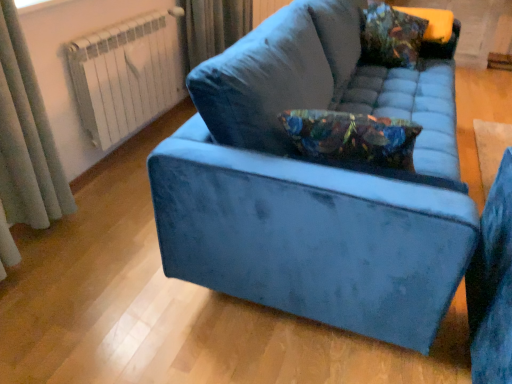
Identify the location of free space to the back side of gray fabric curtain at left. (92, 194).